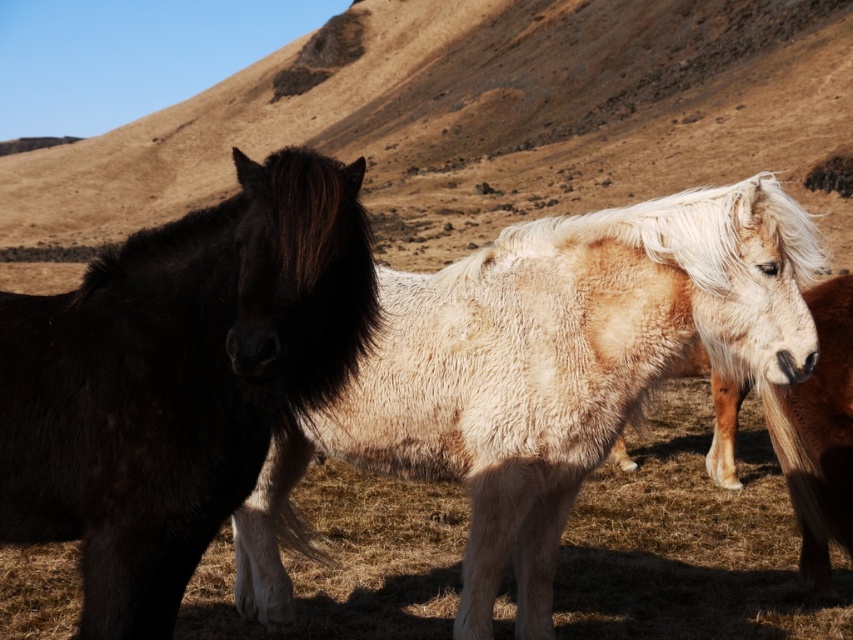
Between shiny black horse at left and light brown fuzzy horse at right, which one has less height?

shiny black horse at left is shorter.

Does point (70, 342) come closer to viewer compared to point (837, 486)?

That is True.

You are a GUI agent. You are given a task and a screenshot of the screen. Output one action in this format:
    pyautogui.click(x=<x>, y=<y>)
    Task: Click on the shiny black horse at left
    The height and width of the screenshot is (640, 853).
    Given the screenshot: What is the action you would take?
    pyautogui.click(x=178, y=378)

This screenshot has width=853, height=640. What are the coordinates of `shiny black horse at left` in the screenshot? It's located at (178, 378).

Is point (437, 280) positioned before point (824, 529)?

Yes, it is.

Does fluffy white horse at center have a larger size compared to light brown fuzzy horse at right?

Yes.

Where is `fluffy white horse at center`? fluffy white horse at center is located at coordinates (543, 374).

Is fluffy white horse at center above shiny black horse at left?

No.

Which is more to the right, fluffy white horse at center or shiny black horse at left?

From the viewer's perspective, fluffy white horse at center appears more on the right side.

Locate an element on the screen. fluffy white horse at center is located at coordinates (543, 374).